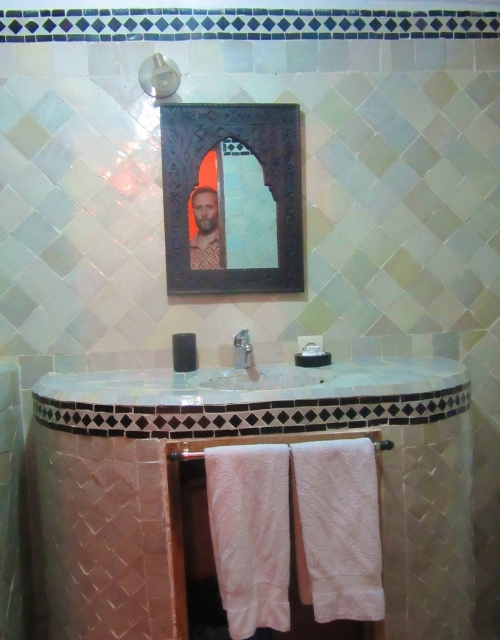
You are designing a bathroom layout and need to know the relative sizes of the metallic silver shower head at upper center and the wooden towel bar at center. Which one is wider?

The metallic silver shower head at upper center is wider than the wooden towel bar at center.

You are standing in the bathroom and want to take a photo of the dark wood mirror at upper center using a camera that has a minimum focusing distance of 5 feet. Can you take the photo without moving closer?

The dark wood mirror at upper center and camera are 6.91 feet apart from each other, so yes, you can take the photo without moving closer since the distance is beyond the camera minimum focusing distance of 5 feet.

You are standing in the bathroom and want to place a small plant between the two points, point [158,92] and point [377,449]. Which point should the plant be closer to so it appears closer to you?

The plant should be placed closer to point [158,92] because it is closer to the viewer compared to point [377,449].